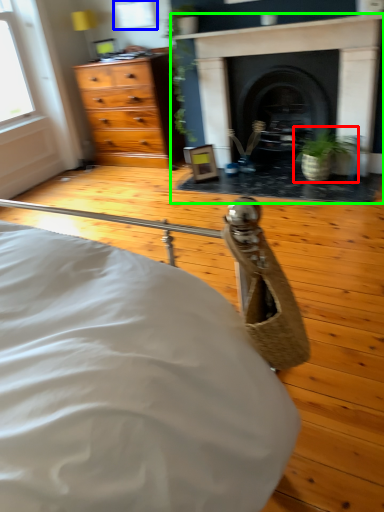
Question: Considering the real-world distances, which object is closest to houseplant (highlighted by a red box)? window (highlighted by a blue box) or fireplace (highlighted by a green box).

Choices:
 (A) window
 (B) fireplace

Answer: (B)